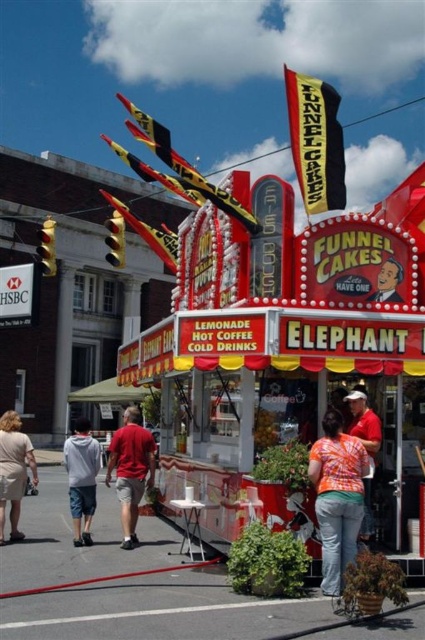
Is point (337, 444) closer to viewer compared to point (73, 536)?

Yes, it is in front of point (73, 536).

Is point (328, 525) positioned in front of point (79, 492)?

Yes, it is.

The height and width of the screenshot is (640, 425). What are the coordinates of `orange tie-dye shirt at center` in the screenshot? It's located at (337, 497).

Can you confirm if orange tie-dye shirt at center is positioned to the left of matte red shirt at center?

Incorrect, orange tie-dye shirt at center is not on the left side of matte red shirt at center.

Is point (334, 436) closer to viewer compared to point (130, 440)?

Yes, point (334, 436) is in front of point (130, 440).

I want to click on orange tie-dye shirt at center, so click(x=337, y=497).

The width and height of the screenshot is (425, 640). I want to click on orange tie-dye shirt at center, so click(337, 497).

Is matte red shirt at center smaller than orange printed shirt at center?

No.

Which of these two, matte red shirt at center or orange printed shirt at center, stands shorter?

With less height is orange printed shirt at center.

This screenshot has height=640, width=425. In order to click on matte red shirt at center in this screenshot , I will do `click(130, 468)`.

I want to click on matte red shirt at center, so click(x=130, y=468).